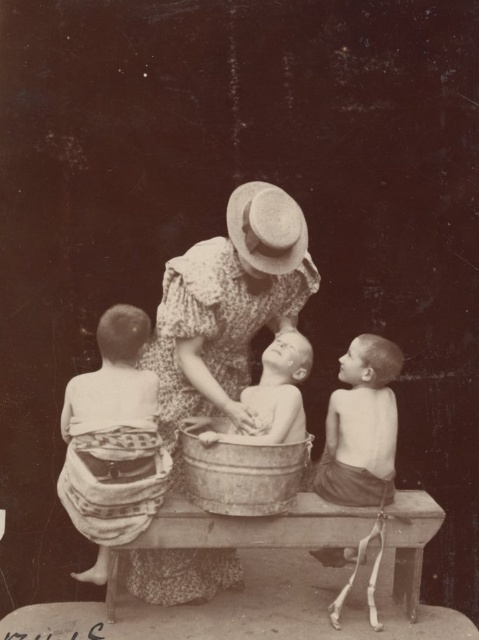
Does smooth skin baby at center have a greater height compared to straw hat at center?

Correct, smooth skin baby at center is much taller as straw hat at center.

What do you see at coordinates (274, 396) in the screenshot? I see `smooth skin baby at center` at bounding box center [274, 396].

Between point (248, 401) and point (286, 250), which one is positioned behind?

The point (248, 401) is more distant.

Identify the location of smooth skin baby at center. This screenshot has width=479, height=640. (274, 396).

Between floral fabric dress at center and smooth skin boy at right, which one is positioned lower?

smooth skin boy at right

Is floral fabric dress at center wider than smooth skin boy at right?

Yes, floral fabric dress at center is wider than smooth skin boy at right.

I want to click on floral fabric dress at center, so click(228, 305).

Who is positioned more to the left, floral fabric dress at center or smooth skin baby at center?

Positioned to the left is floral fabric dress at center.

The height and width of the screenshot is (640, 479). What do you see at coordinates (228, 305) in the screenshot?
I see `floral fabric dress at center` at bounding box center [228, 305].

This screenshot has height=640, width=479. I want to click on floral fabric dress at center, so click(x=228, y=305).